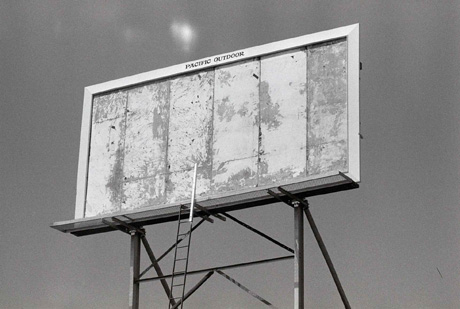
Where is `ladder`? This screenshot has height=309, width=460. ladder is located at coordinates (190, 258).